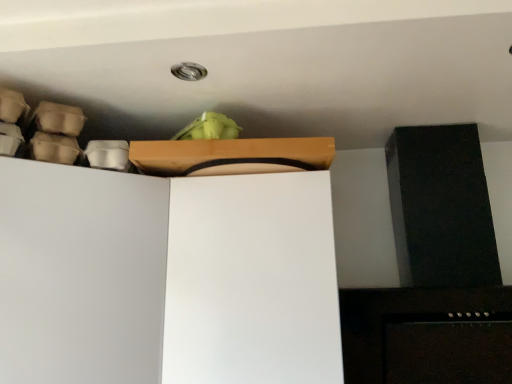
Question: In terms of size, does wooden box at upper center appear bigger or smaller than white matte cabinet at upper left?

Choices:
 (A) big
 (B) small

Answer: (B)

Question: From their relative heights in the image, would you say wooden box at upper center is taller or shorter than white matte cabinet at upper left?

Choices:
 (A) short
 (B) tall

Answer: (A)

Question: Would you say wooden box at upper center is inside or outside white matte cabinet at upper left?

Choices:
 (A) outside
 (B) inside

Answer: (A)

Question: Is point (280, 379) closer or farther from the camera than point (282, 152)?

Choices:
 (A) closer
 (B) farther

Answer: (A)

Question: Considering the positions of white matte cabinet at upper left and wooden box at upper center in the image, is white matte cabinet at upper left taller or shorter than wooden box at upper center?

Choices:
 (A) short
 (B) tall

Answer: (B)

Question: Do you think white matte cabinet at upper left is within wooden box at upper center, or outside of it?

Choices:
 (A) inside
 (B) outside

Answer: (B)

Question: Based on their positions, is white matte cabinet at upper left located to the left or right of wooden box at upper center?

Choices:
 (A) right
 (B) left

Answer: (B)